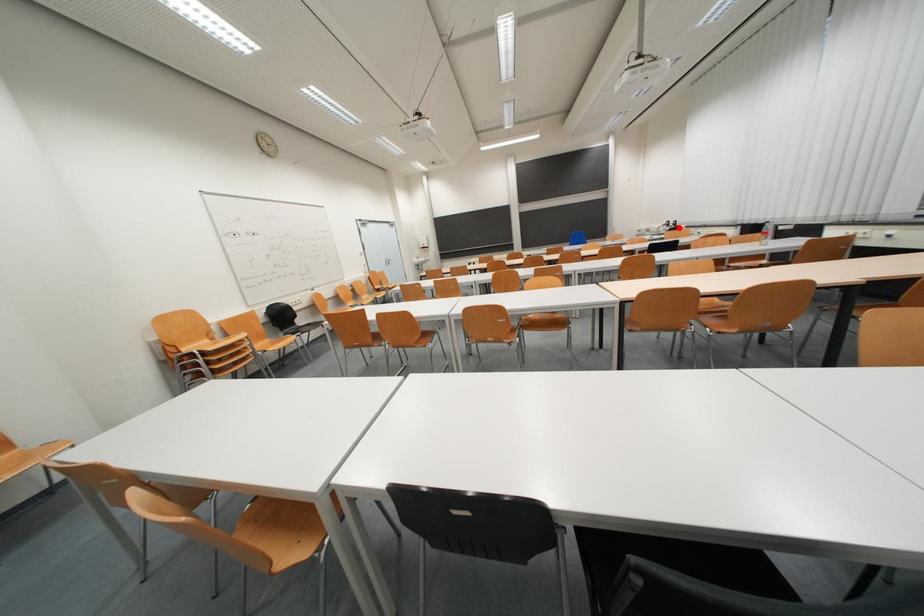
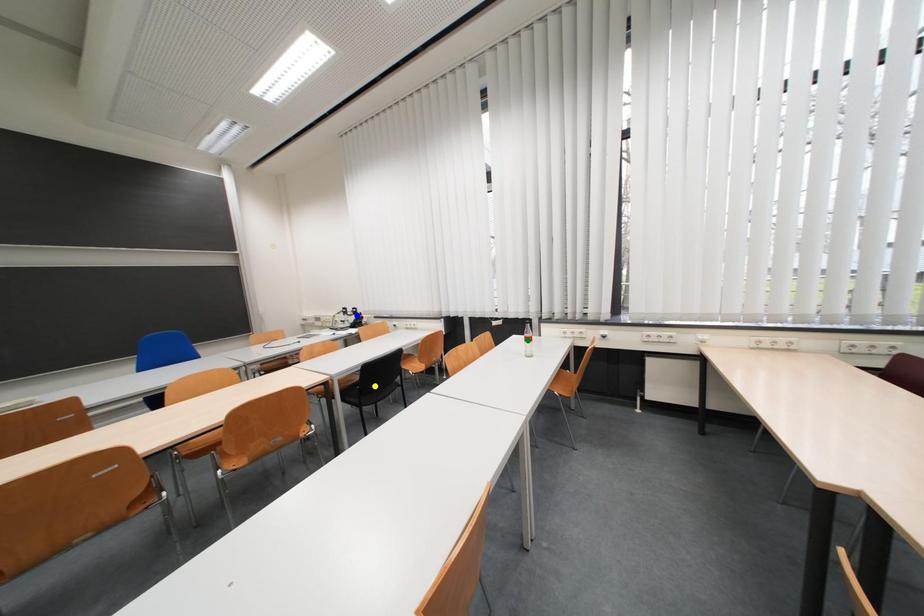
Question: I am providing you with two images of the same scene from different viewpoints. A red point is marked on the first image. You are given multiple points on the second image. Can you choose the point in image 2 that corresponds to the point in image 1?

Choices:
 (A) green point
 (B) blue point
 (C) yellow point

Answer: (B)